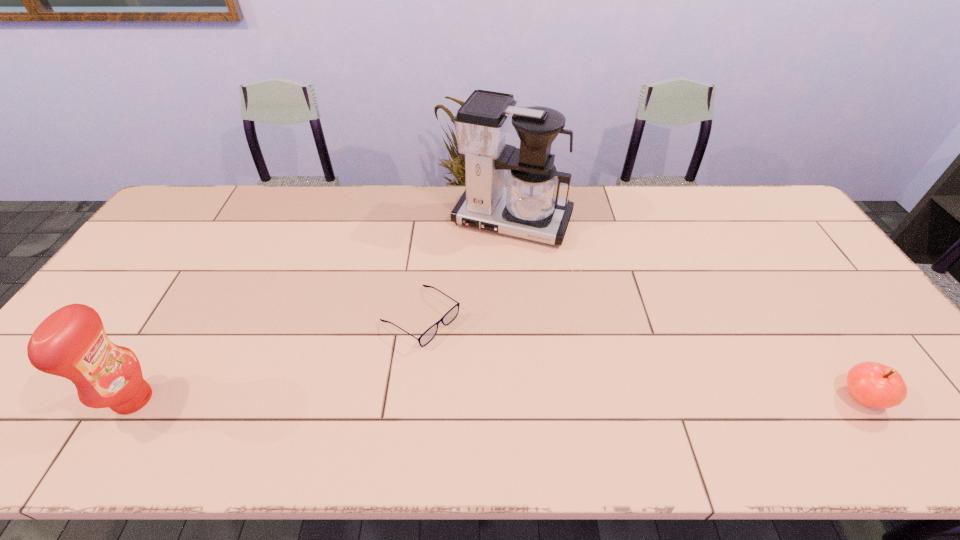
Identify the location of object located at the near right corner. (872, 384).

In the image, there is a desktop. Where is `vacant region at the far edge`? vacant region at the far edge is located at coordinates (254, 213).

Where is `free space at the near edge of the desktop`? free space at the near edge of the desktop is located at coordinates (662, 397).

This screenshot has width=960, height=540. I want to click on blank space at the left edge of the desktop, so click(x=188, y=262).

You are a GUI agent. You are given a task and a screenshot of the screen. Output one action in this format:
    pyautogui.click(x=<x>, y=<y>)
    Task: Click on the free space at the far right corner
    Image resolution: width=960 pixels, height=540 pixels.
    Given the screenshot: What is the action you would take?
    pyautogui.click(x=745, y=199)

Find the location of `vacant space in between the third shortest object and the tallest object`. vacant space in between the third shortest object and the tallest object is located at coordinates (323, 310).

The image size is (960, 540). I want to click on free space between the leftmost object and the spectacles, so click(277, 358).

You are a GUI agent. You are given a task and a screenshot of the screen. Output one action in this format:
    pyautogui.click(x=<x>, y=<y>)
    Task: Click on the blank region between the second shortest object and the leftmost object
    
    Given the screenshot: What is the action you would take?
    pyautogui.click(x=497, y=399)

This screenshot has height=540, width=960. In order to click on unoccupied area between the leftmost object and the farthest object in this screenshot , I will do `click(323, 310)`.

Image resolution: width=960 pixels, height=540 pixels. Identify the location of unoccupied position between the leftmost object and the rightmost object. (497, 399).